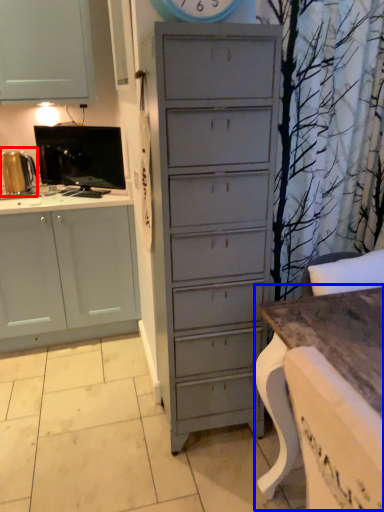
Question: Which of the following is the closest to the observer, appliance (highlighted by a red box) or table (highlighted by a blue box)?

Choices:
 (A) appliance
 (B) table

Answer: (B)